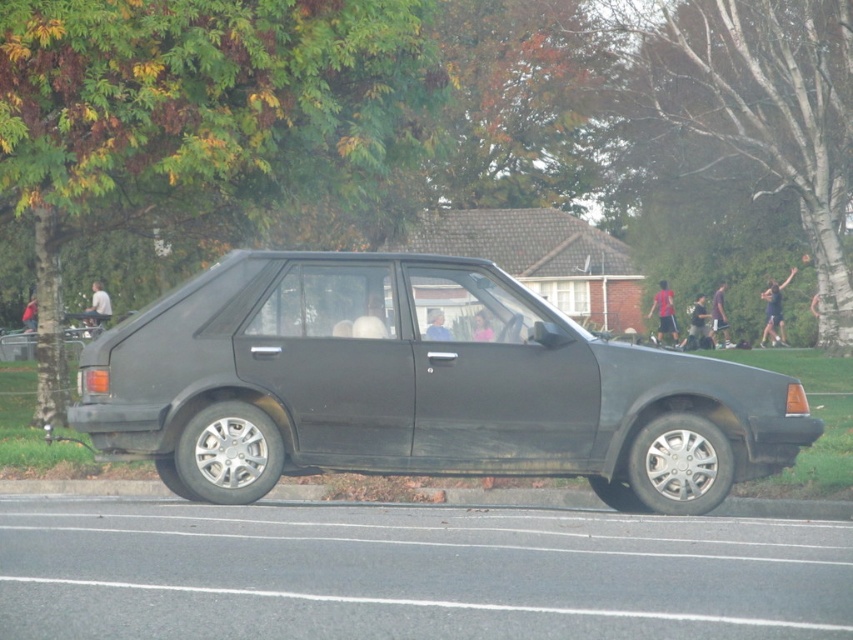
Question: Among these points, which one is nearest to the camera?

Choices:
 (A) (471, 458)
 (B) (33, 492)

Answer: (A)

Question: Considering the relative positions of matte black sedan at center and concrete at lower center in the image provided, where is matte black sedan at center located with respect to concrete at lower center?

Choices:
 (A) below
 (B) above

Answer: (B)

Question: Does matte black sedan at center have a greater width compared to concrete at lower center?

Choices:
 (A) no
 (B) yes

Answer: (B)

Question: Which point is farther to the camera?

Choices:
 (A) matte black sedan at center
 (B) concrete at lower center

Answer: (B)

Question: Is the position of matte black sedan at center more distant than that of concrete at lower center?

Choices:
 (A) yes
 (B) no

Answer: (B)

Question: Which object appears closest to the camera in this image?

Choices:
 (A) matte black sedan at center
 (B) concrete at lower center

Answer: (A)